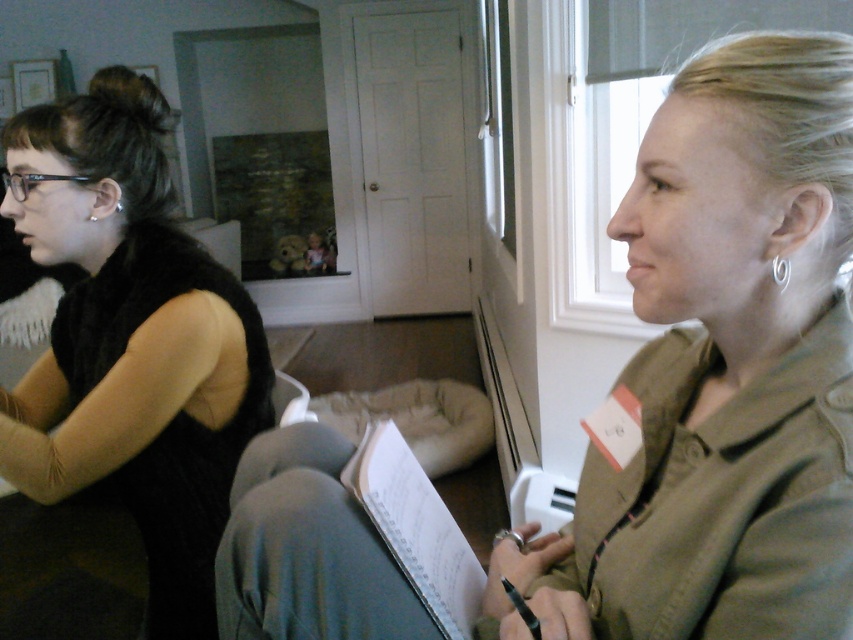
Is point (714, 557) farther from camera compared to point (456, 570)?

No, it is not.

This screenshot has height=640, width=853. In order to click on matte olive green jacket at right in this screenshot , I will do `click(723, 371)`.

Does point (676, 604) lie behind point (436, 625)?

That is False.

This screenshot has height=640, width=853. I want to click on matte olive green jacket at right, so click(x=723, y=371).

Which is below, matte olive green jacket at right or silver metallic earring at right ear?

matte olive green jacket at right is below.

Measure the distance between point (819,236) and camera.

Point (819,236) and camera are 24.86 inches apart.

Locate an element on the screen. This screenshot has height=640, width=853. matte olive green jacket at right is located at coordinates (723, 371).

Does white paper at center have a greater width compared to silver metallic earring at right ear?

Correct, the width of white paper at center exceeds that of silver metallic earring at right ear.

Is white paper at center in front of silver metallic earring at right ear?

No, it is behind silver metallic earring at right ear.

Is point (381, 499) closer to camera compared to point (772, 260)?

No, (381, 499) is behind (772, 260).

Find the location of a particular element. The height and width of the screenshot is (640, 853). white paper at center is located at coordinates pyautogui.click(x=416, y=529).